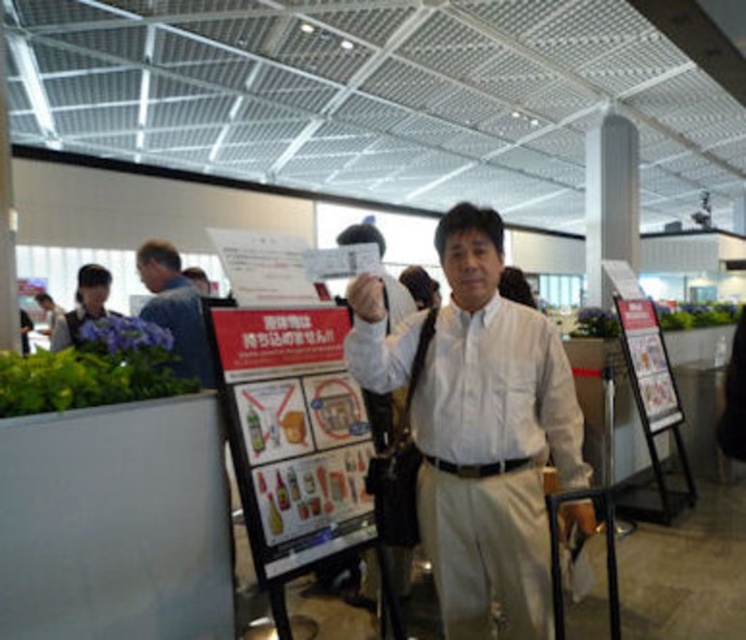
Can you confirm if white smooth shirt at center is shorter than blue denim shirt at left?

Indeed, white smooth shirt at center has a lesser height compared to blue denim shirt at left.

Is white smooth shirt at center closer to camera compared to blue denim shirt at left?

Yes, white smooth shirt at center is in front of blue denim shirt at left.

Is point (383, 358) positioned behind point (210, 364)?

No, (383, 358) is in front of (210, 364).

Find the location of a particular element. white smooth shirt at center is located at coordinates (498, 392).

Can you confirm if white textured shirt at center is positioned above white smooth shirt at center?

No.

Between point (354, 310) and point (536, 417), which one is positioned behind?

The point (536, 417) is behind.

Is point (520, 532) more distant than point (501, 305)?

No.

Identify the location of white textured shirt at center. The image size is (746, 640). (489, 440).

Is blue denim shirt at left wider than matte black shirt at left?

Correct, the width of blue denim shirt at left exceeds that of matte black shirt at left.

From the picture: Can you confirm if blue denim shirt at left is positioned above matte black shirt at left?

Actually, blue denim shirt at left is below matte black shirt at left.

Which is behind, point (144, 257) or point (93, 296)?

The point (93, 296) is more distant.

In order to click on blue denim shirt at left in this screenshot , I will do `click(175, 308)`.